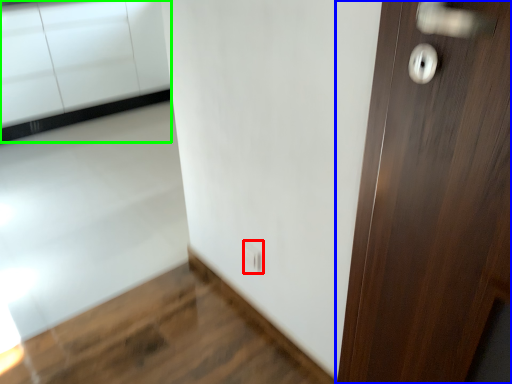
Question: Considering the real-world distances, which object is closest to electric outlet (highlighted by a red box)? door (highlighted by a blue box) or cabinetry (highlighted by a green box).

Choices:
 (A) door
 (B) cabinetry

Answer: (A)